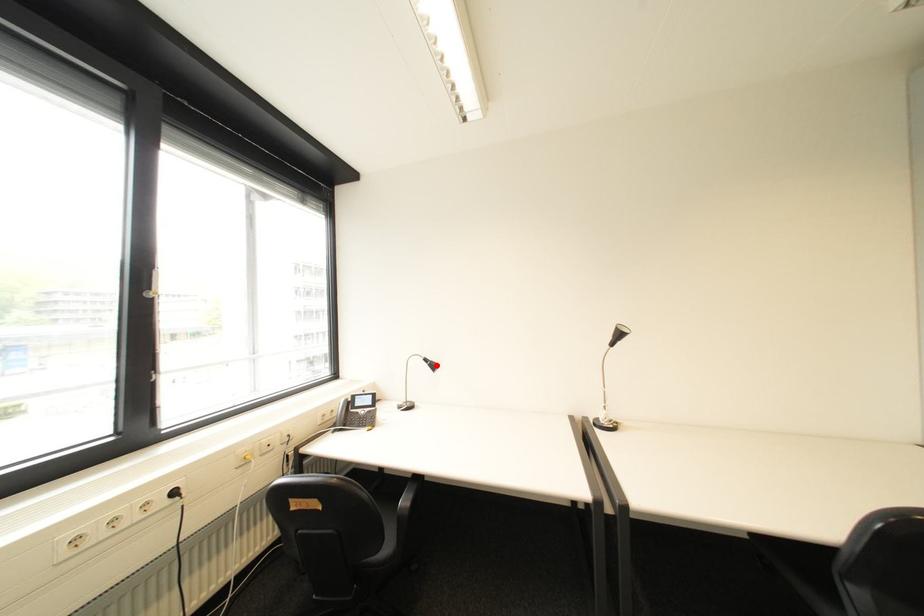
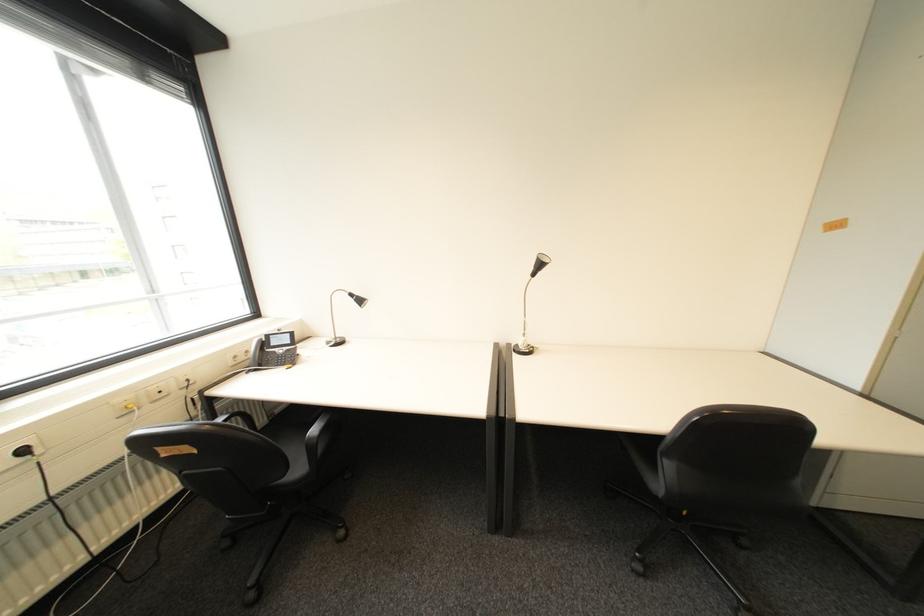
Locate, in the second image, the point that corresponds to the highlighted location in the first image.

(362, 301)